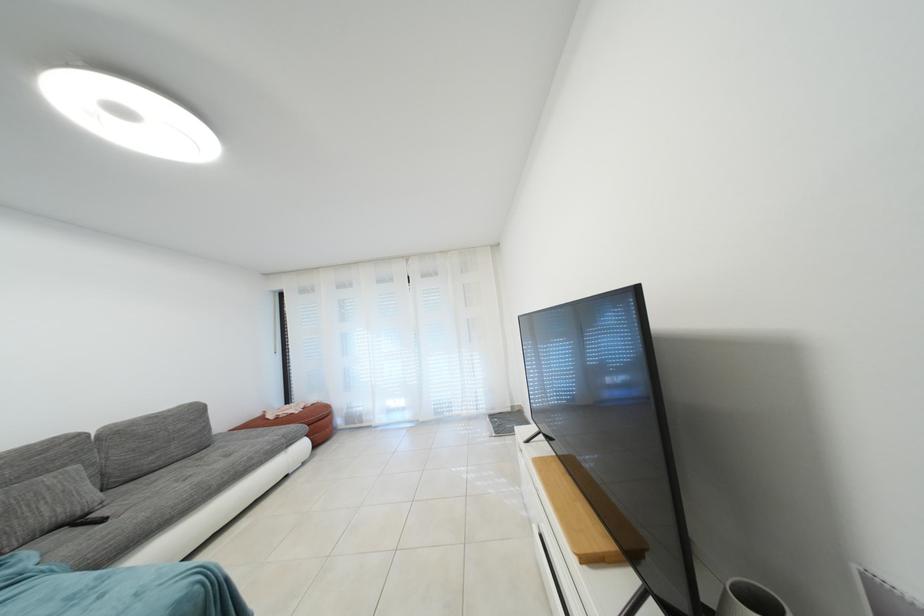
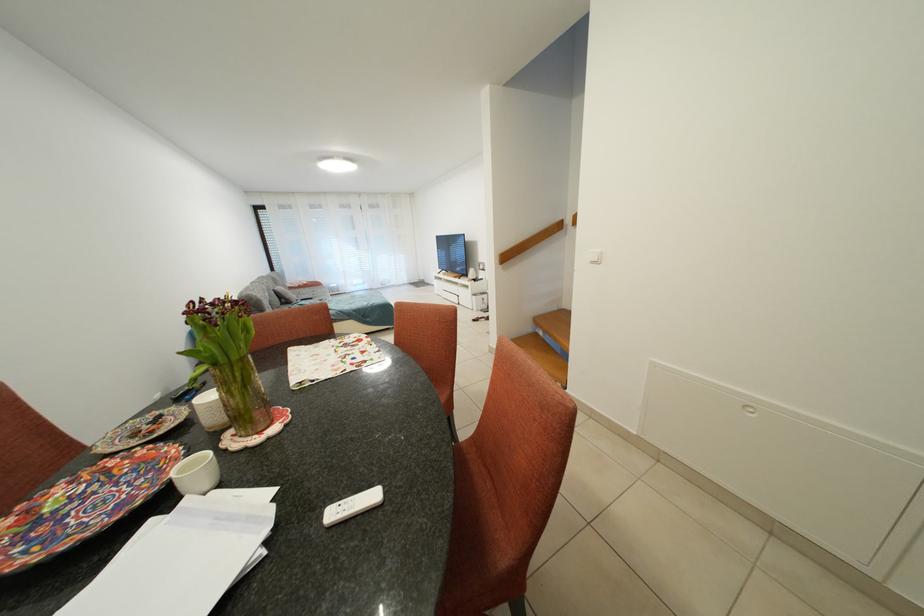
In the second image, find the point that corresponds to the point at 416,419 in the first image.

(373, 291)